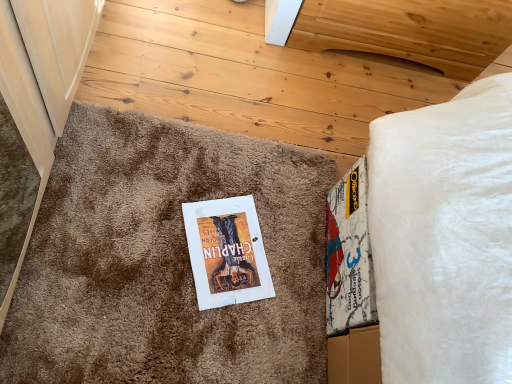
This screenshot has width=512, height=384. Identify the location of vacant space behind white paper book at center. (256, 182).